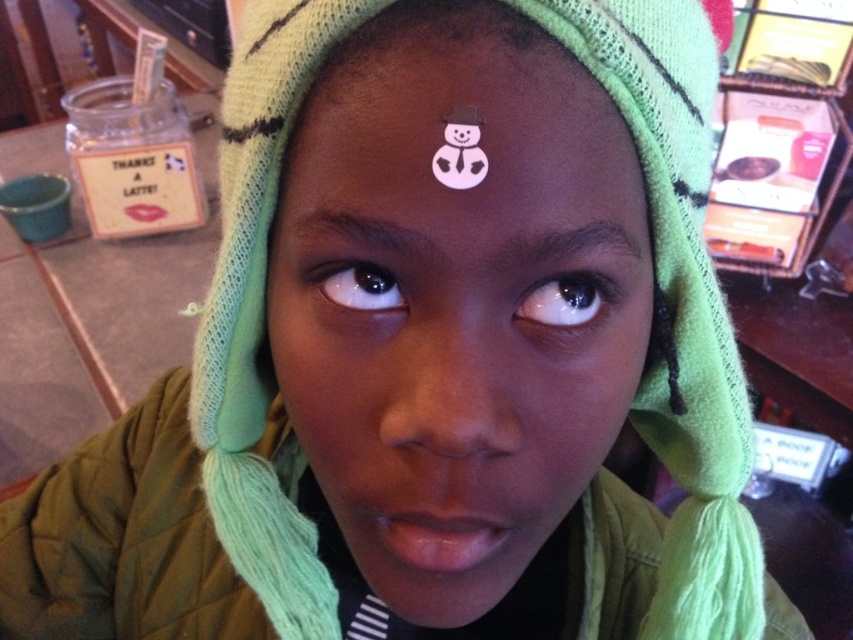
This screenshot has width=853, height=640. What do you see at coordinates (450, 99) in the screenshot?
I see `pink paper snowman at center` at bounding box center [450, 99].

Does pink paper snowman at center come in front of brown matte eye at center?

That is True.

Identify the location of pink paper snowman at center. (450, 99).

Looking at this image, which of these two, pink paper snowman at center or black glossy eye at center, stands taller?

pink paper snowman at center

Can you confirm if pink paper snowman at center is thinner than black glossy eye at center?

No, pink paper snowman at center is not thinner than black glossy eye at center.

Find the location of a particular element. This screenshot has height=640, width=853. pink paper snowman at center is located at coordinates (450, 99).

Locate an element on the screen. The image size is (853, 640). pink paper snowman at center is located at coordinates (450, 99).

Is black glossy eye at center in front of brown matte eye at center?

Yes, black glossy eye at center is in front of brown matte eye at center.

Which is in front, point (543, 292) or point (357, 259)?

Point (357, 259) is in front.

This screenshot has width=853, height=640. Find the location of `black glossy eye at center`. black glossy eye at center is located at coordinates click(x=566, y=300).